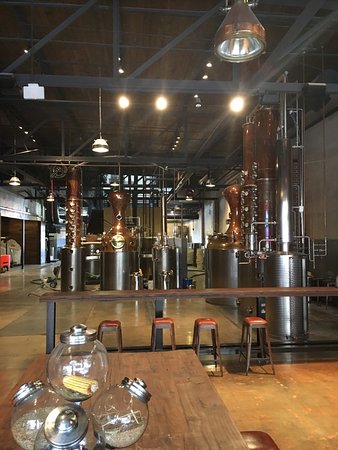
I want to click on spotlights, so click(236, 103), click(164, 103), click(122, 101).